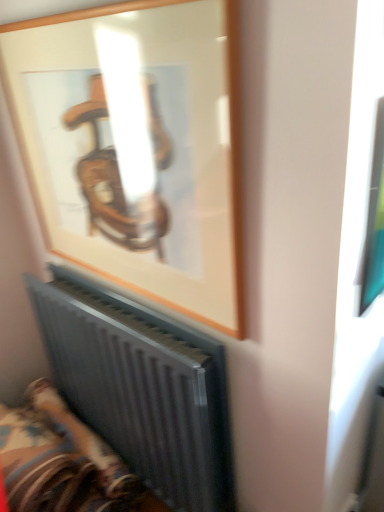
Question: Can you see metallic radiator at lower left touching wooden frame at upper center?

Choices:
 (A) no
 (B) yes

Answer: (A)

Question: Is metallic radiator at lower left facing towards wooden frame at upper center?

Choices:
 (A) yes
 (B) no

Answer: (B)

Question: Considering the relative positions of metallic radiator at lower left and wooden frame at upper center in the image provided, is metallic radiator at lower left to the right of wooden frame at upper center from the viewer's perspective?

Choices:
 (A) yes
 (B) no

Answer: (B)

Question: Is metallic radiator at lower left at the left side of wooden frame at upper center?

Choices:
 (A) no
 (B) yes

Answer: (B)

Question: Considering the relative sizes of metallic radiator at lower left and wooden frame at upper center in the image provided, is metallic radiator at lower left bigger than wooden frame at upper center?

Choices:
 (A) no
 (B) yes

Answer: (B)

Question: Is metallic radiator at lower left further to the viewer compared to wooden frame at upper center?

Choices:
 (A) no
 (B) yes

Answer: (B)

Question: Considering the relative sizes of metallic gray radiator at lower left and metallic radiator at lower left in the image provided, is metallic gray radiator at lower left smaller than metallic radiator at lower left?

Choices:
 (A) no
 (B) yes

Answer: (B)

Question: Could you tell me if metallic gray radiator at lower left is turned towards metallic radiator at lower left?

Choices:
 (A) yes
 (B) no

Answer: (A)

Question: From a real-world perspective, is metallic gray radiator at lower left physically above metallic radiator at lower left?

Choices:
 (A) no
 (B) yes

Answer: (B)

Question: Can you confirm if metallic gray radiator at lower left is taller than metallic radiator at lower left?

Choices:
 (A) no
 (B) yes

Answer: (B)

Question: From the image's perspective, is metallic gray radiator at lower left on top of metallic radiator at lower left?

Choices:
 (A) yes
 (B) no

Answer: (A)

Question: Can we say metallic gray radiator at lower left lies outside metallic radiator at lower left?

Choices:
 (A) no
 (B) yes

Answer: (B)

Question: Does wooden frame at upper center have a greater width compared to metallic radiator at lower left?

Choices:
 (A) no
 (B) yes

Answer: (A)